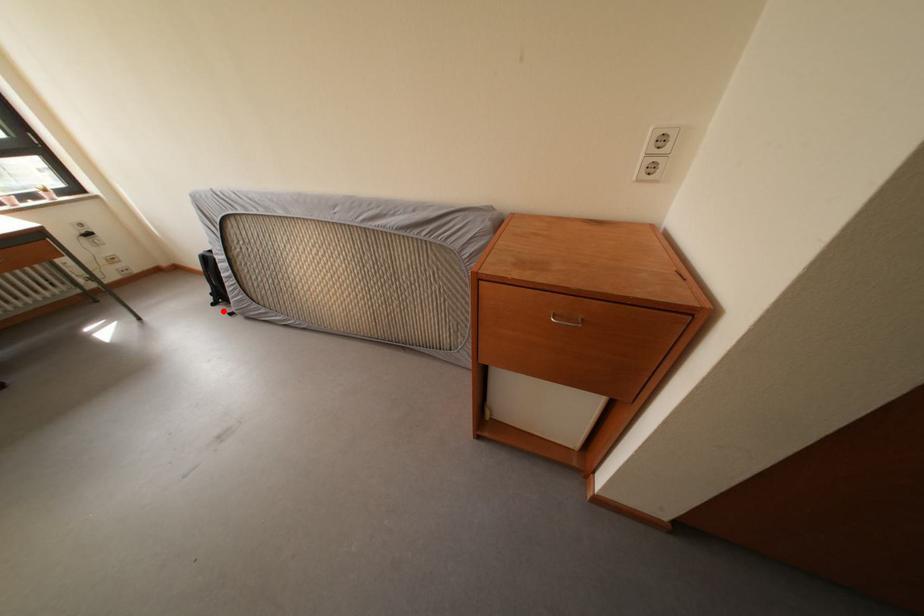
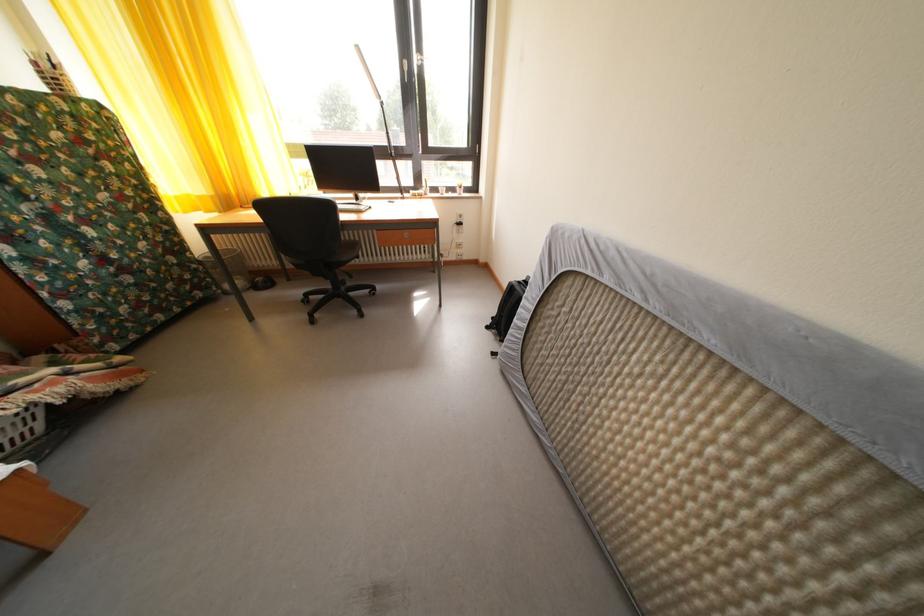
Question: A red point is marked in image1. In image2, is the corresponding 3D point closer to the camera or farther? Reply with the corresponding letter.

Choices:
 (A) The corresponding 3D point is closer.
 (B) The corresponding 3D point is farther.

Answer: (A)